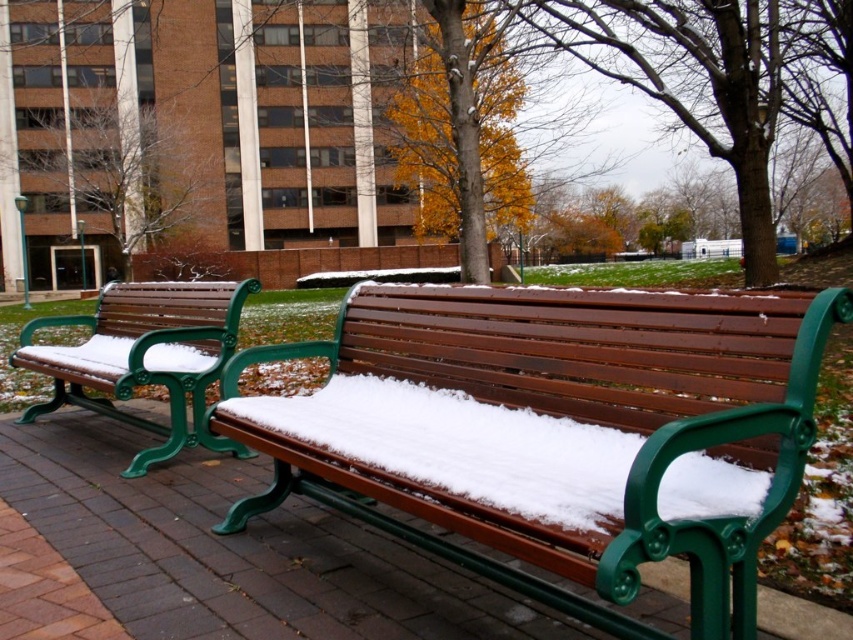
You are an architect designing a new public space and want to place a decorative sculpture exactly where the white fluffy snow at center is located. Using a coordinate system where the bottom left corner of the image is the origin point, what are the coordinates you should use for the sculpture?

The coordinates for the white fluffy snow at center are at point (462, 445) in the 2D location, so you should place the sculpture at those coordinates.

You are a person standing at the edge of the brick area and want to sit on the wooden bench at left. However, you notice there is white fluffy snow at center in the way. Can you walk around it to reach the bench without stepping on the snow?

The white fluffy snow at center is to the right of the wooden bench at left, so you can walk around it to the left side of the snow to reach the bench without stepping on the snow.